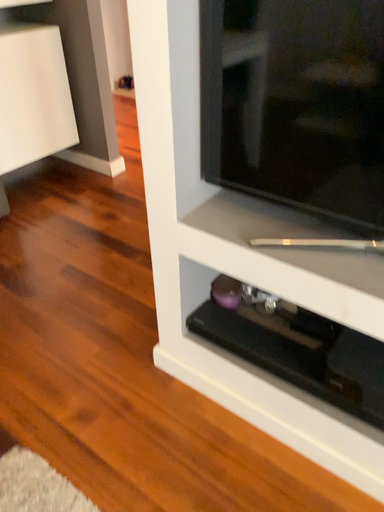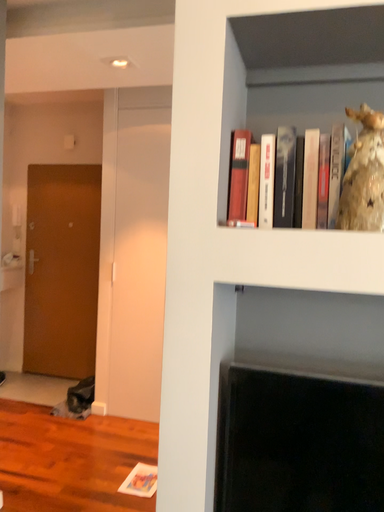
Question: Which way did the camera rotate in the video?

Choices:
 (A) rotated downward
 (B) rotated upward

Answer: (B)